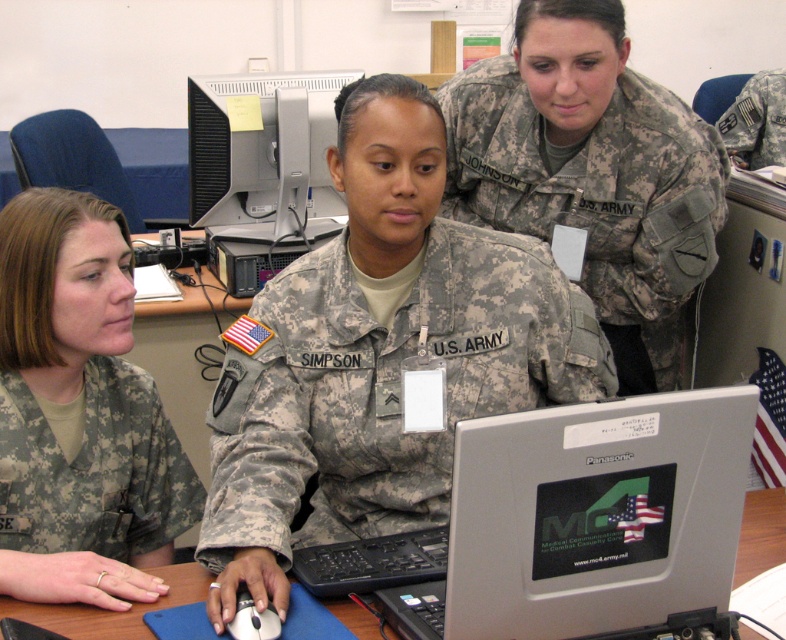
Question: Does camouflage uniform at left have a greater width compared to camouflage fabric us army uniform at upper right?

Choices:
 (A) no
 (B) yes

Answer: (A)

Question: Which point is closer to the camera?

Choices:
 (A) (619, 164)
 (B) (724, 612)
 (C) (267, 544)

Answer: (B)

Question: Is camouflage fabric us army uniform at upper right smaller than blue rubber mousepad at lower center?

Choices:
 (A) no
 (B) yes

Answer: (A)

Question: Based on their relative distances, which object is nearer to the matte gray monitor at center?

Choices:
 (A) black plastic mouse at lower center
 (B) camouflage fabric us army uniform at center
 (C) silver metallic laptop at center
 (D) camouflage fabric us army uniform at upper right

Answer: (D)

Question: Does silver metallic laptop at center appear on the left side of camouflage fabric uniform at left?

Choices:
 (A) yes
 (B) no

Answer: (B)

Question: Among these points, which one is nearest to the camera?

Choices:
 (A) (296, 170)
 (B) (314, 429)
 (C) (590, 259)
 (D) (87, 355)

Answer: (D)